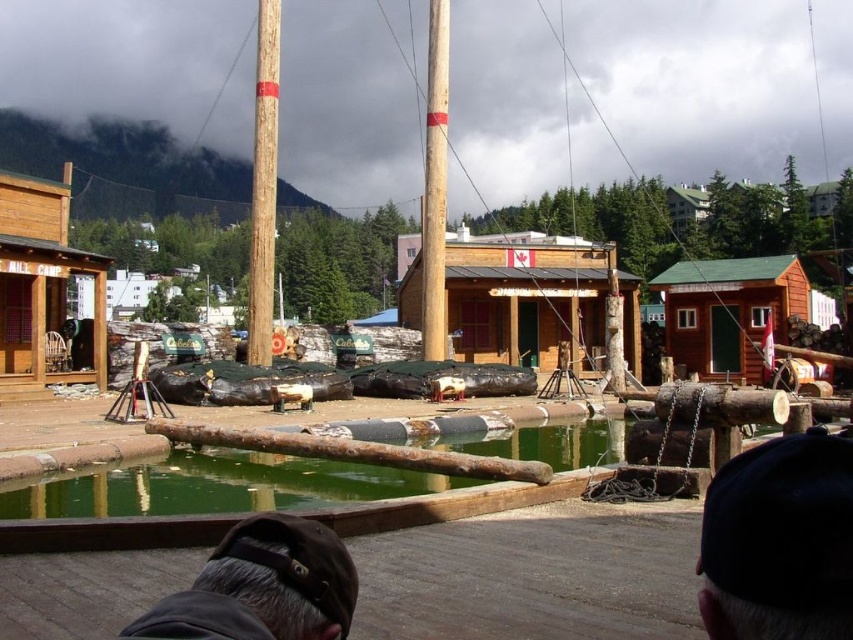
Is point (763, 506) positioned in front of point (709, 323)?

Yes.

Can you confirm if dark gray fabric cap at lower right is wider than brown wooden cabin at center-right?

In fact, dark gray fabric cap at lower right might be narrower than brown wooden cabin at center-right.

Describe the element at coordinates (779, 541) in the screenshot. I see `dark gray fabric cap at lower right` at that location.

Where is `dark gray fabric cap at lower right`? The height and width of the screenshot is (640, 853). dark gray fabric cap at lower right is located at coordinates (779, 541).

Looking at this image, is smooth wooden pole at upper center to the right of smooth wooden pole at center from the viewer's perspective?

No, smooth wooden pole at upper center is not to the right of smooth wooden pole at center.

Does smooth wooden pole at upper center appear under smooth wooden pole at center?

Correct, smooth wooden pole at upper center is located below smooth wooden pole at center.

Image resolution: width=853 pixels, height=640 pixels. I want to click on smooth wooden pole at upper center, so click(x=263, y=182).

Which of these two, dark brown fabric cap at lower left or wooden cabin at left, stands taller?

wooden cabin at left is taller.

Between dark brown fabric cap at lower left and wooden cabin at left, which one appears on the left side from the viewer's perspective?

wooden cabin at left is more to the left.

Who is more forward, (273, 637) or (26, 257)?

Point (273, 637) is in front.

At what (x,y) coordinates should I click in order to perform the action: click on dark brown fabric cap at lower left. Please return your answer as a coordinate pair (x, y). The image size is (853, 640). Looking at the image, I should click on (263, 586).